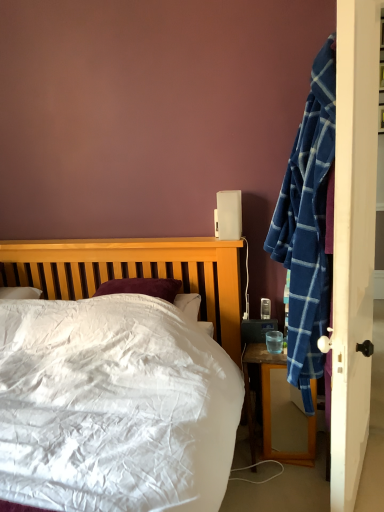
What do you see at coordinates (270, 407) in the screenshot?
I see `wooden desk at right` at bounding box center [270, 407].

Locate an element on the screen. Image resolution: width=384 pixels, height=512 pixels. clear glass cup at nightstand right is located at coordinates (274, 342).

Is white plastic speaker at upper right inside the boundaries of wooden desk at right, or outside?

white plastic speaker at upper right is not inside wooden desk at right, it's outside.

Relative to wooden desk at right, is white plastic speaker at upper right in front or behind?

In the image, white plastic speaker at upper right appears behind wooden desk at right.

From a real-world perspective, is white plastic speaker at upper right on wooden desk at right?

Yes, from a real-world perspective, white plastic speaker at upper right is above wooden desk at right.

In the scene shown: Which is more to the left, white plastic speaker at upper right or clear glass cup at nightstand right?

From the viewer's perspective, white plastic speaker at upper right appears more on the left side.

In the scene shown: From the image's perspective, would you say white plastic speaker at upper right is positioned over clear glass cup at nightstand right?

Yes, from the image's perspective, white plastic speaker at upper right is over clear glass cup at nightstand right.

Considering the sizes of objects white plastic speaker at upper right and clear glass cup at nightstand right in the image provided, who is bigger, white plastic speaker at upper right or clear glass cup at nightstand right?

white plastic speaker at upper right.

Measure the distance from white plastic speaker at upper right to clear glass cup at nightstand right.

white plastic speaker at upper right is 21.85 inches away from clear glass cup at nightstand right.

Between wooden desk at right and clear glass cup at nightstand right, which one appears on the right side from the viewer's perspective?

wooden desk at right is more to the right.

Considering the sizes of objects wooden desk at right and clear glass cup at nightstand right in the image provided, who is thinner, wooden desk at right or clear glass cup at nightstand right?

Thinner between the two is clear glass cup at nightstand right.

Is wooden desk at right smaller than clear glass cup at nightstand right?

No.

Is wooden desk at right positioned with its back to clear glass cup at nightstand right?

No, clear glass cup at nightstand right is not at the back of wooden desk at right.

Are wooden desk at right and white plastic speaker at upper right far apart?

No, wooden desk at right is not far away from white plastic speaker at upper right.

Is wooden desk at right surrounding white plastic speaker at upper right?

Actually, white plastic speaker at upper right is outside wooden desk at right.

Is point (247, 381) in front of point (233, 239)?

Yes.

Considering the relative positions of clear glass cup at nightstand right and wooden desk at right in the image provided, is clear glass cup at nightstand right to the right of wooden desk at right from the viewer's perspective?

No, clear glass cup at nightstand right is not to the right of wooden desk at right.

Does clear glass cup at nightstand right have a larger size compared to wooden desk at right?

Actually, clear glass cup at nightstand right might be smaller than wooden desk at right.

Which object is further away from the camera, clear glass cup at nightstand right or wooden desk at right?

clear glass cup at nightstand right is behind.

Identify the location of coffee cup on the left of the wooden desk at right. (274, 342).

Does clear glass cup at nightstand right have a smaller size compared to white plastic speaker at upper right?

Correct, clear glass cup at nightstand right occupies less space than white plastic speaker at upper right.

Which object is closer to the camera, clear glass cup at nightstand right or white plastic speaker at upper right?

clear glass cup at nightstand right is in front.

Is clear glass cup at nightstand right at the right side of white plastic speaker at upper right?

Indeed, clear glass cup at nightstand right is positioned on the right side of white plastic speaker at upper right.

At what (x,y) coordinates should I click in order to perform the action: click on desk on the right of the white plastic speaker at upper right. Please return your answer as a coordinate pair (x, y). The image size is (384, 512). Looking at the image, I should click on (270, 407).

This screenshot has width=384, height=512. Find the location of `loudspeaker above the clear glass cup at nightstand right (from the image's perspective)`. loudspeaker above the clear glass cup at nightstand right (from the image's perspective) is located at coordinates (229, 214).

Looking at this image, from the image, which object appears to be nearer to clear glass cup at nightstand right, wooden desk at right or white plastic speaker at upper right?

Based on the image, wooden desk at right appears to be nearer to clear glass cup at nightstand right.

Estimate the real-world distances between objects in this image. Which object is closer to wooden desk at right, clear glass cup at nightstand right or white plastic speaker at upper right?

The object closer to wooden desk at right is clear glass cup at nightstand right.

Which object lies further to the anchor point wooden desk at right, white plastic speaker at upper right or clear glass cup at nightstand right?

The object further to wooden desk at right is white plastic speaker at upper right.

Which object lies nearer to the anchor point white plastic speaker at upper right, wooden desk at right or clear glass cup at nightstand right?

clear glass cup at nightstand right is closer to white plastic speaker at upper right.

From the image, which object appears to be nearer to clear glass cup at nightstand right, white plastic speaker at upper right or wooden desk at right?

wooden desk at right is positioned closer to the anchor clear glass cup at nightstand right.

When comparing their distances from white plastic speaker at upper right, does clear glass cup at nightstand right or wooden desk at right seem closer?

clear glass cup at nightstand right lies closer to white plastic speaker at upper right than the other object.

I want to click on coffee cup between white plastic speaker at upper right and wooden desk at right in the vertical direction, so click(274, 342).